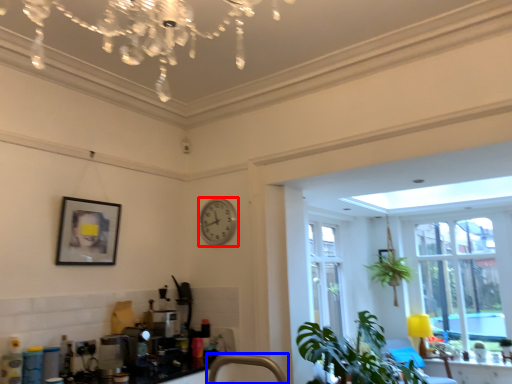
Question: Which of the following is the farthest to the observer, clock (highlighted by a red box) or faucet (highlighted by a blue box)?

Choices:
 (A) clock
 (B) faucet

Answer: (A)